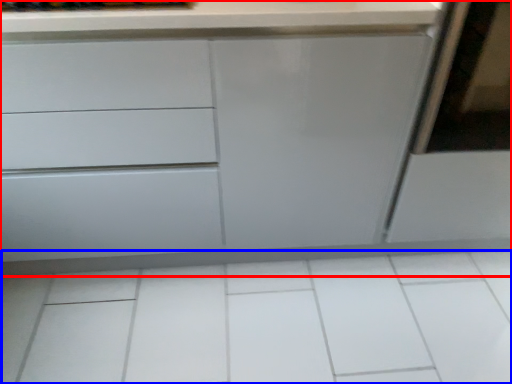
Question: Which of the following is the closest to the observer, chest of drawers (highlighted by a red box) or ceramic tile (highlighted by a blue box)?

Choices:
 (A) chest of drawers
 (B) ceramic tile

Answer: (A)